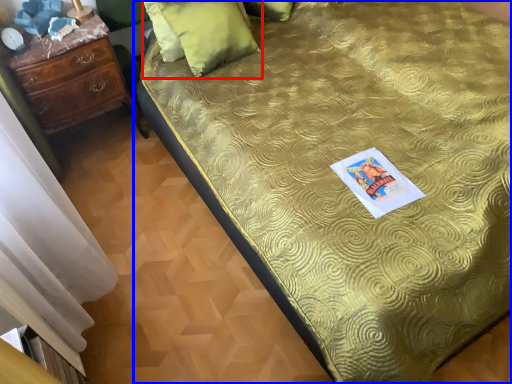
Question: Among these objects, which one is farthest to the camera, pillow (highlighted by a red box) or bed (highlighted by a blue box)?

Choices:
 (A) pillow
 (B) bed

Answer: (A)